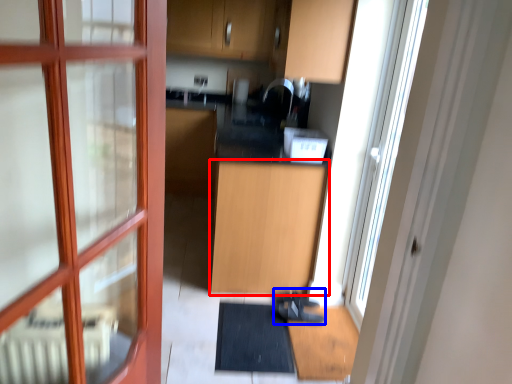
Question: Which of the following is the farthest to the observer, cabinetry (highlighted by a red box) or shoe (highlighted by a blue box)?

Choices:
 (A) cabinetry
 (B) shoe

Answer: (B)